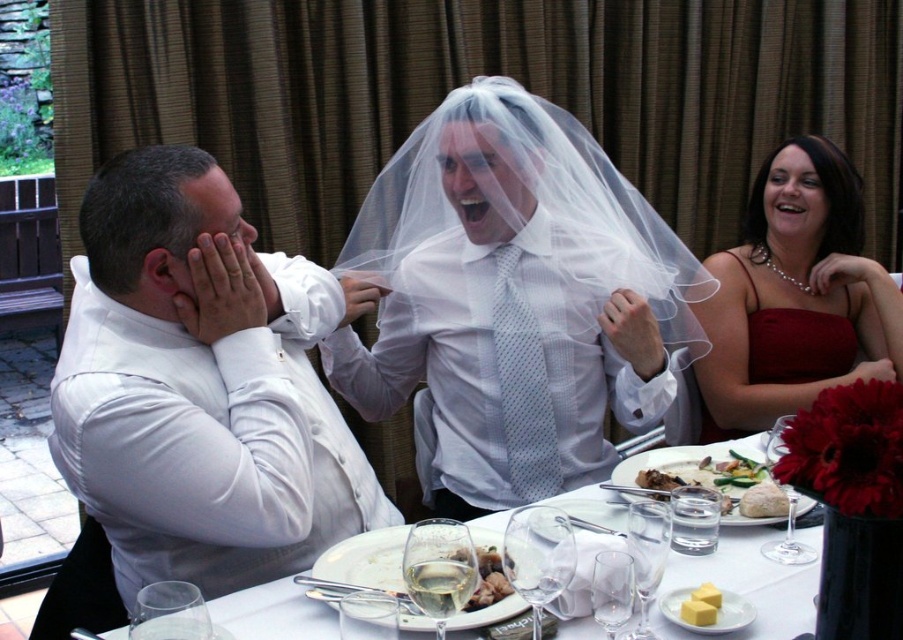
Can you confirm if translucent white veil at center is positioned below white porcelain plate at center?

Actually, translucent white veil at center is above white porcelain plate at center.

Between translucent white veil at center and white porcelain plate at center, which one has less height?

white porcelain plate at center

Where is `translucent white veil at center`? translucent white veil at center is located at coordinates (514, 300).

Can you confirm if matte red dress at upper right is positioned to the right of white porcelain plate at center?

Indeed, matte red dress at upper right is positioned on the right side of white porcelain plate at center.

Measure the distance between matte red dress at upper right and white porcelain plate at center.

A distance of 1.28 meters exists between matte red dress at upper right and white porcelain plate at center.

In order to click on matte red dress at upper right in this screenshot , I will do `click(794, 296)`.

Can you confirm if translucent white veil at center is shorter than white glossy plate at center?

In fact, translucent white veil at center may be taller than white glossy plate at center.

Which of these two, translucent white veil at center or white glossy plate at center, stands shorter?

white glossy plate at center

Identify the location of translucent white veil at center. (514, 300).